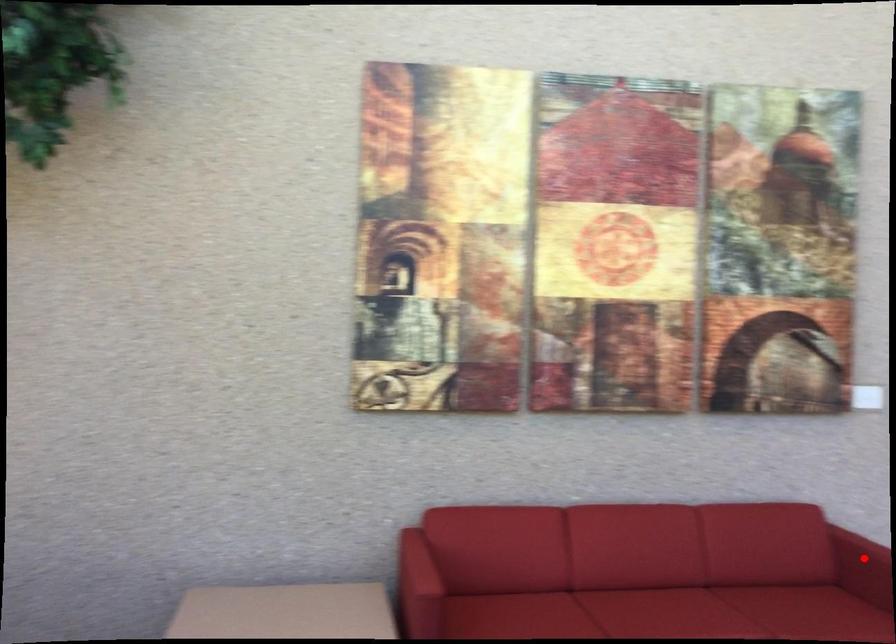
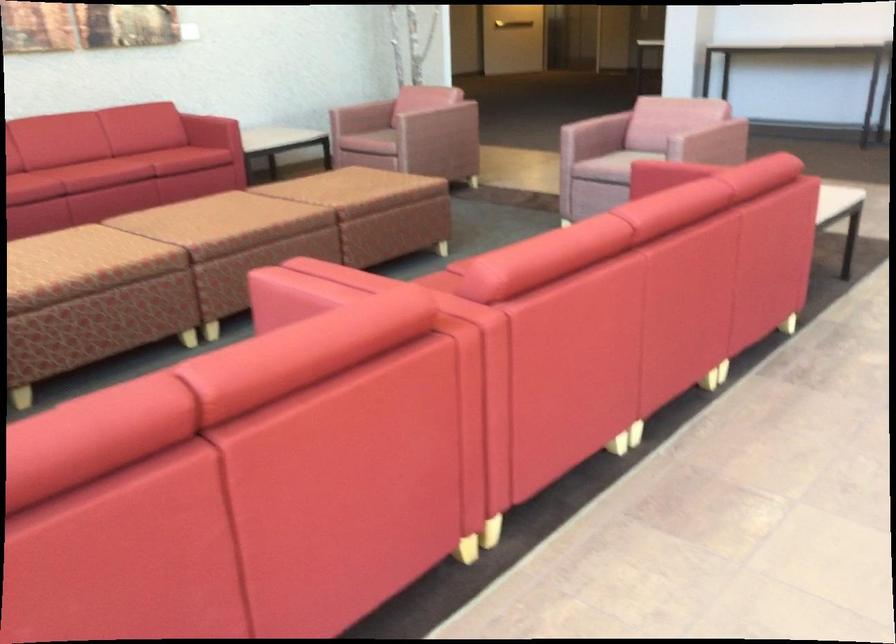
Question: I am providing you with two images of the same scene from different viewpoints. A red point is marked on the first image. At the location where the point appears in image 1, is it still visible in image 2?

Choices:
 (A) Yes
 (B) No

Answer: (B)